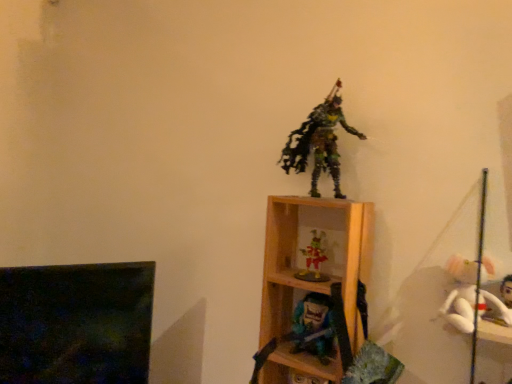
Question: From a real-world perspective, is matte blue plastic toy at center, which is the first toy in bottom-to-top order, physically located above or below multicolored plastic figure at center, which is the 4th toy in bottom-to-top order?

Choices:
 (A) above
 (B) below

Answer: (B)

Question: Choose the correct answer: Is matte blue plastic toy at center, which is the first toy in bottom-to-top order, inside multicolored plastic figure at center, which is the first toy in top-to-bottom order, or outside it?

Choices:
 (A) outside
 (B) inside

Answer: (A)

Question: Estimate the real-world distances between objects in this image. Which object is farther from the wooden shelf at center?

Choices:
 (A) shiny plastic figurine at center, the third toy from the bottom
 (B) multicolored plastic figure at center, which is the first toy in top-to-bottom order
 (C) white plush at right, which is the third toy from top to bottom
 (D) matte blue plastic toy at center, marked as the 4th toy in a top-to-bottom arrangement

Answer: (C)

Question: Which object is the closest to the shiny plastic figurine at center, the third toy from the bottom?

Choices:
 (A) matte blue plastic toy at center, which is the first toy in bottom-to-top order
 (B) wooden shelf at center
 (C) multicolored plastic figure at center, which is the 4th toy in bottom-to-top order
 (D) white plush at right, which is the second toy from bottom to top

Answer: (B)